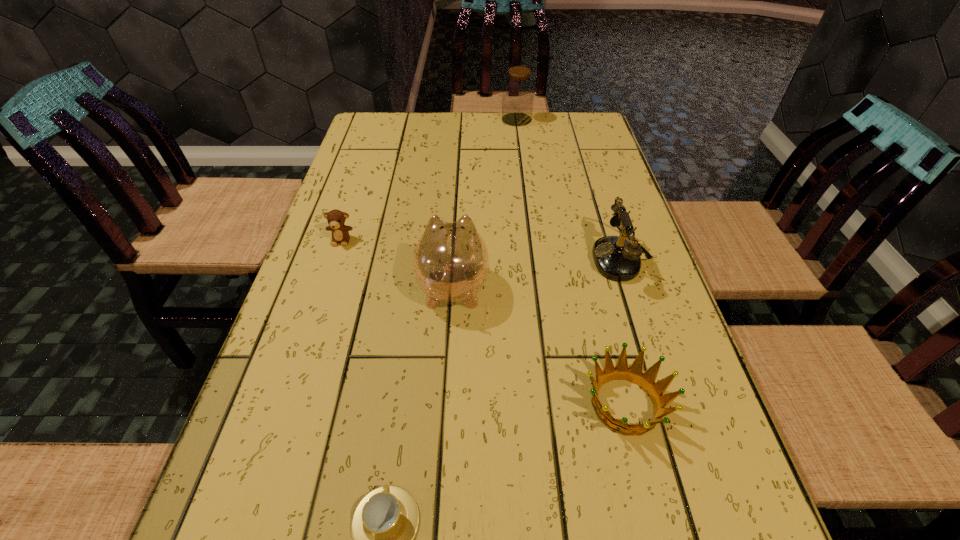
In the image, there is a desktop. At what (x,y) coordinates should I click in order to perform the action: click on free space at the left edge. Please return your answer as a coordinate pair (x, y). The image size is (960, 540). Looking at the image, I should click on (364, 312).

The width and height of the screenshot is (960, 540). I want to click on free spot at the right edge of the desktop, so click(600, 166).

At what (x,y) coordinates should I click in order to perform the action: click on vacant point at the far left corner. Please return your answer as a coordinate pair (x, y). This screenshot has height=540, width=960. Looking at the image, I should click on (367, 134).

The width and height of the screenshot is (960, 540). I want to click on free space at the far right corner, so click(608, 145).

At what (x,y) coordinates should I click in order to perform the action: click on vacant region between the second nearest object and the third object from right to left. Please return your answer as a coordinate pair (x, y). This screenshot has width=960, height=540. Looking at the image, I should click on (571, 262).

At what (x,y) coordinates should I click in order to perform the action: click on unoccupied position between the third object from right to left and the fifth farthest object. Please return your answer as a coordinate pair (x, y). Image resolution: width=960 pixels, height=540 pixels. Looking at the image, I should click on (x=571, y=262).

Identify the location of vacant point located between the crown and the telephone. (623, 330).

Where is `free point between the piggy bank and the fourth shortest object`? Image resolution: width=960 pixels, height=540 pixels. free point between the piggy bank and the fourth shortest object is located at coordinates (538, 272).

The height and width of the screenshot is (540, 960). What are the coordinates of `unoccupied position between the piggy bank and the telephone` in the screenshot? It's located at (538, 272).

Locate an element on the screen. The image size is (960, 540). vacant region between the piggy bank and the leftmost object is located at coordinates (397, 263).